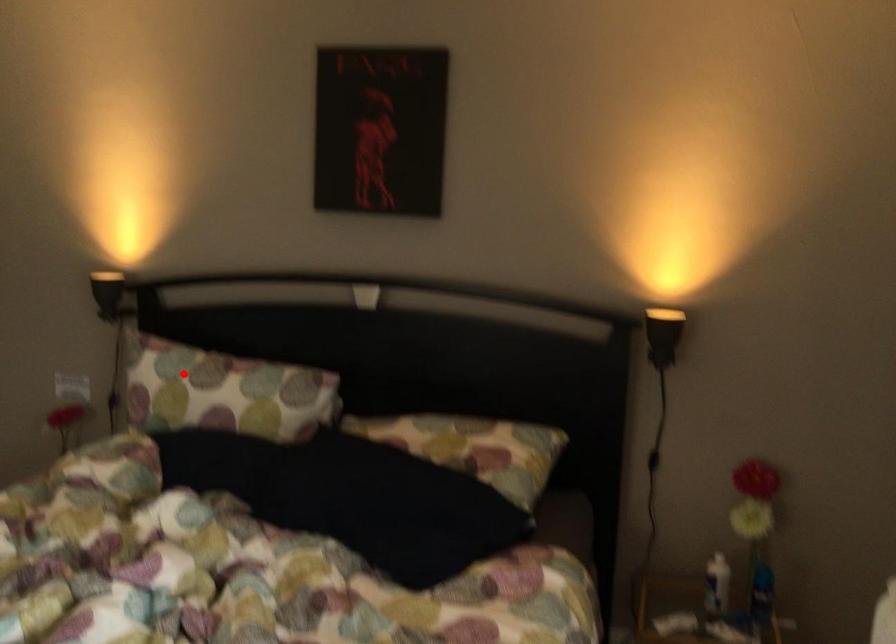
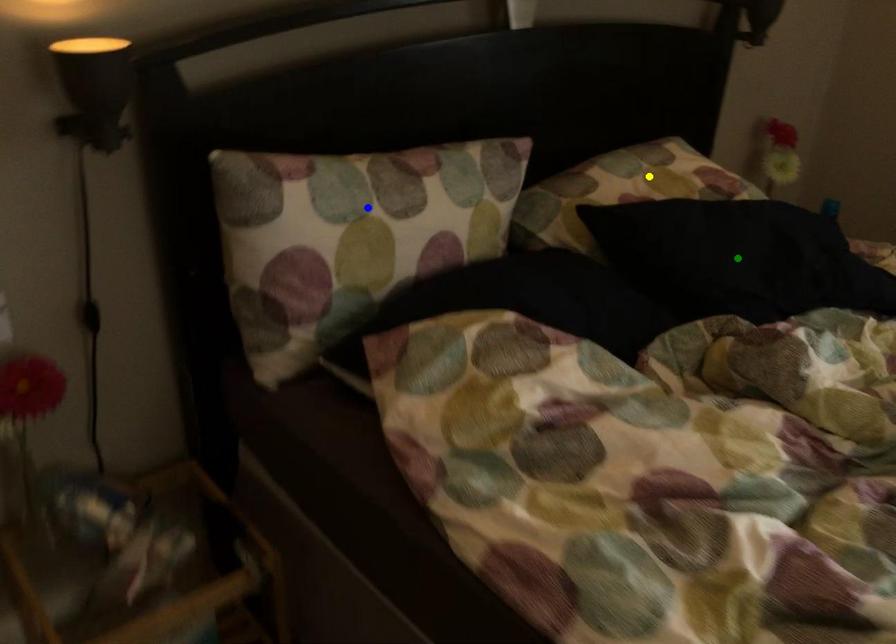
Question: I am providing you with two images of the same scene from different viewpoints. A red point is marked on the first image. You are given multiple points on the second image. Which point in image 2 represents the same 3d spot as the red point in image 1?

Choices:
 (A) green point
 (B) yellow point
 (C) blue point

Answer: (C)